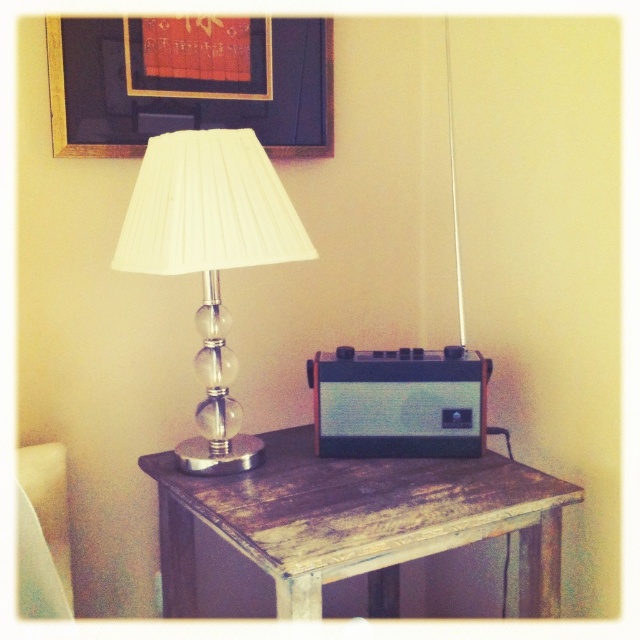
You are arranging a shelf and need to know the height of the objects. Which one is taller between the distressed wood table at center and the matte gold picture frame at upper center?

The distressed wood table at center is taller than the matte gold picture frame at upper center according to the description.

You are a delivery person who needs to place a small package on the matte gold picture frame at upper center. The package is 1.3 meters long. Will the package fit on the frame?

The matte gold picture frame at upper center is 1.27 meters in distance from the camera, so the package which is 1.3 meters long will not fit on the frame as it is slightly longer than the frame.

You are standing in the room and want to place a small decorative item on the table. You have two points marked on the table surface where you can place it. The first point is at coordinates point (333, 552) and the second is at point (264, 182). Which point is closer to you?

Point (333, 552) is closer to the viewer than point (264, 182).